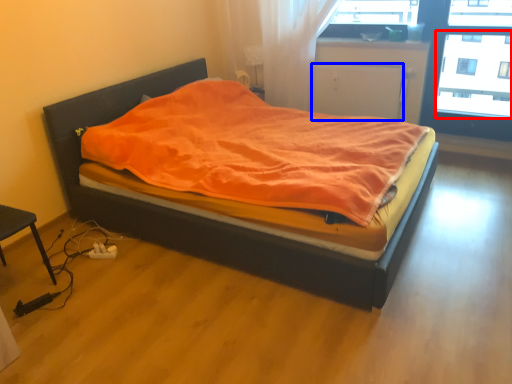
Question: Which object is closer to the camera taking this photo, window screen (highlighted by a red box) or screen door (highlighted by a blue box)?

Choices:
 (A) window screen
 (B) screen door

Answer: (A)